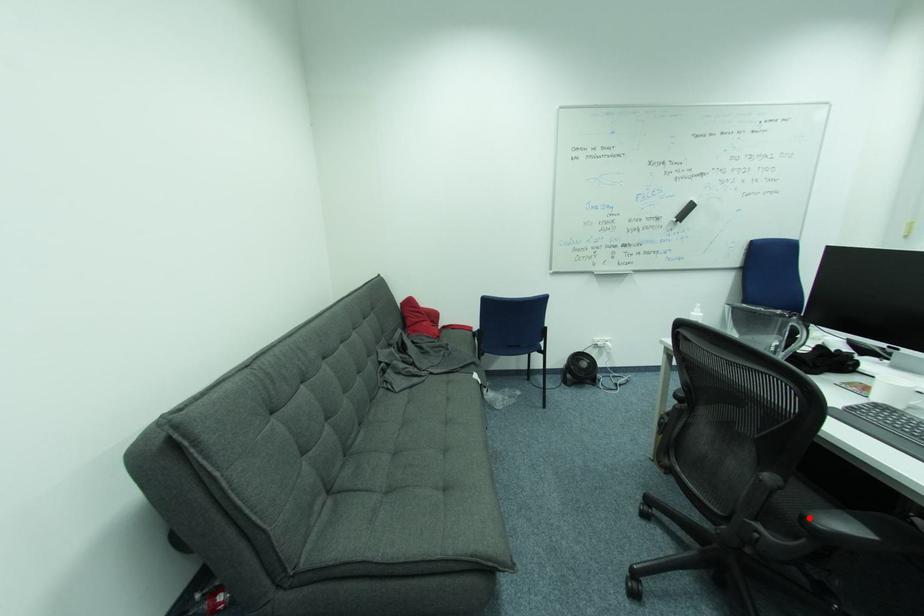
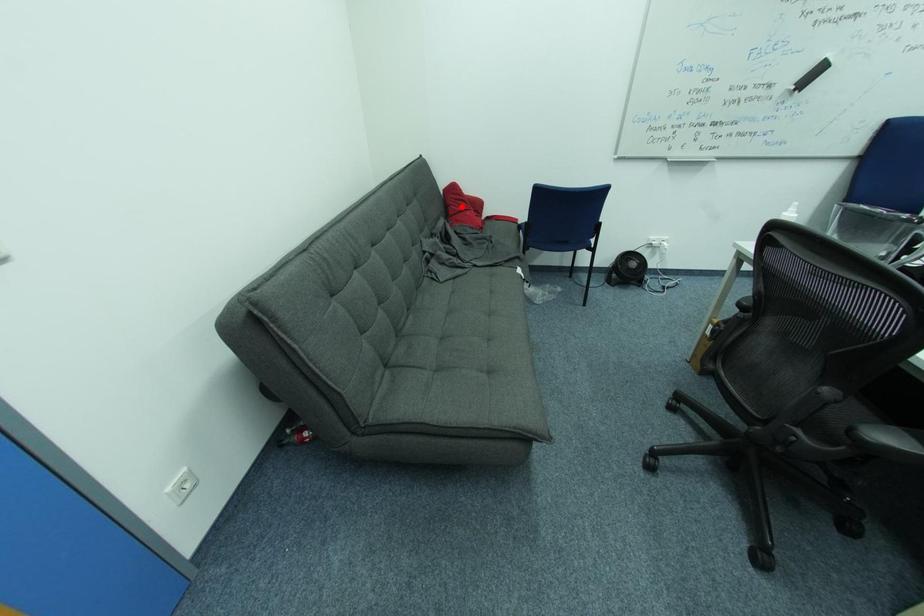
I am providing you with two images of the same scene from different viewpoints. A red point is marked on the first image and another point is marked on the second image. Do the highlighted points in image1 and image2 indicate the same real-world spot?

No